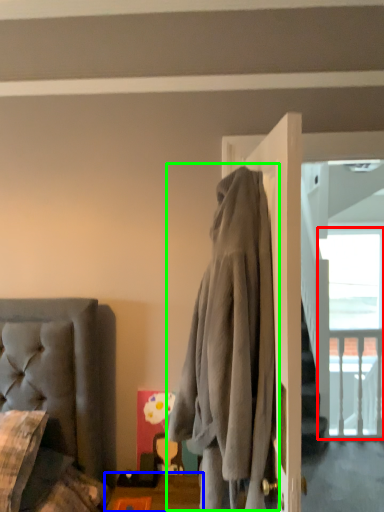
Question: Which object is positioned farthest from window (highlighted by a red box)? Select from table (highlighted by a blue box) and clothing (highlighted by a green box).

Choices:
 (A) table
 (B) clothing

Answer: (B)